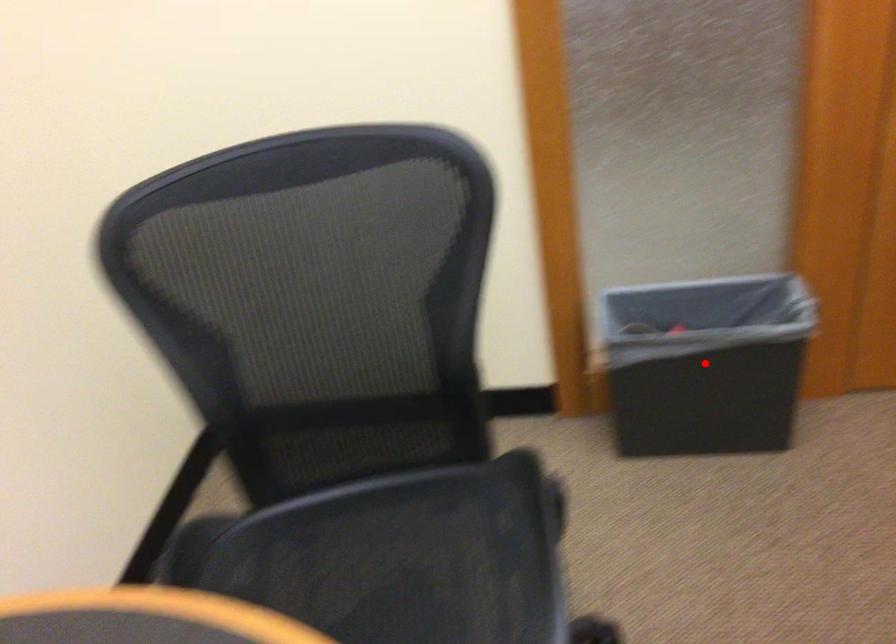
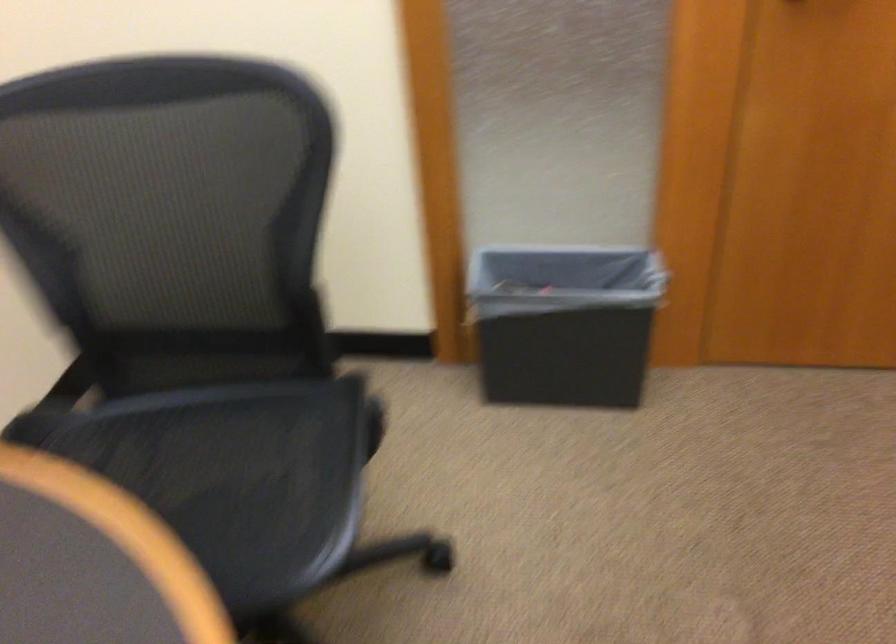
Find the pixel in the second image that matches the highlighted location in the first image.

(564, 323)